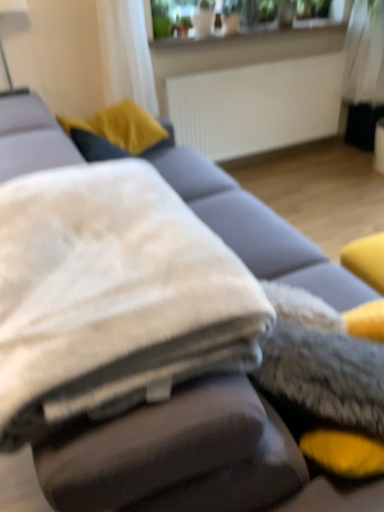
In order to face white textured radiator at upper center, should I rotate leftwards or rightwards?

Rotate right and turn 9.684 degrees.

Describe the element at coordinates (256, 106) in the screenshot. I see `white textured radiator at upper center` at that location.

Locate an element on the screen. This screenshot has height=512, width=384. white textured radiator at upper center is located at coordinates (256, 106).

Measure the distance between point [192,89] and camera.

They are 9.17 feet apart.

Find the location of a particular element. white textured radiator at upper center is located at coordinates (256, 106).